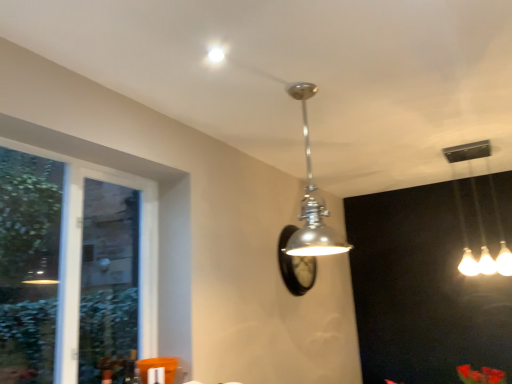
Question: Considering the relative positions of clear glass window at left and white glossy light fixture at upper right, which ranks as the first lamp in right-to-left order, in the image provided, is clear glass window at left behind white glossy light fixture at upper right, which ranks as the first lamp in right-to-left order,?

Choices:
 (A) no
 (B) yes

Answer: (A)

Question: Is there a large distance between clear glass window at left and white glossy light fixture at upper right, which ranks as the first lamp in right-to-left order?

Choices:
 (A) no
 (B) yes

Answer: (B)

Question: Is clear glass window at left shorter than white glossy light fixture at upper right, the 2th lamp when ordered from left to right?

Choices:
 (A) yes
 (B) no

Answer: (B)

Question: Is clear glass window at left not inside white glossy light fixture at upper right, placed as the 1th lamp when sorted from back to front?

Choices:
 (A) no
 (B) yes

Answer: (B)

Question: From a real-world perspective, is clear glass window at left located beneath white glossy light fixture at upper right, placed as the 1th lamp when sorted from back to front?

Choices:
 (A) yes
 (B) no

Answer: (A)

Question: From the image's perspective, would you say clear glass window at left is shown under white glossy light fixture at upper right, placed as the 1th lamp when sorted from back to front?

Choices:
 (A) yes
 (B) no

Answer: (A)

Question: Does clear glass window at left have a lesser width compared to rubberized plastic flowers at center?

Choices:
 (A) no
 (B) yes

Answer: (B)

Question: From a real-world perspective, does clear glass window at left stand above rubberized plastic flowers at center?

Choices:
 (A) no
 (B) yes

Answer: (B)

Question: Is clear glass window at left wider than rubberized plastic flowers at center?

Choices:
 (A) yes
 (B) no

Answer: (B)

Question: Is rubberized plastic flowers at center at the back of clear glass window at left?

Choices:
 (A) no
 (B) yes

Answer: (A)

Question: Is clear glass window at left not inside rubberized plastic flowers at center?

Choices:
 (A) no
 (B) yes

Answer: (B)

Question: Is clear glass window at left bigger than rubberized plastic flowers at center?

Choices:
 (A) no
 (B) yes

Answer: (B)

Question: Does polished chrome pendant light at center, which is counted as the first lamp, starting from the left, have a lesser height compared to clear glass window at left?

Choices:
 (A) no
 (B) yes

Answer: (B)